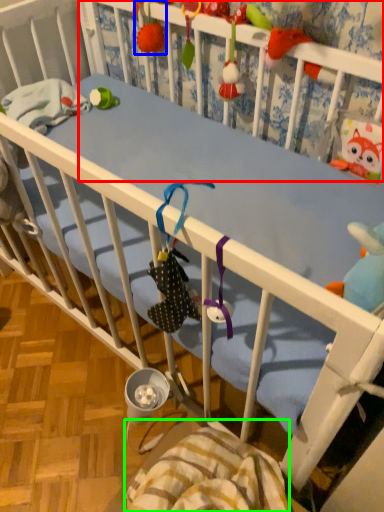
Question: Which object is the farthest from infant bed (highlighted by a red box)? Choose among these: toy (highlighted by a blue box) or blanket (highlighted by a green box).

Choices:
 (A) toy
 (B) blanket

Answer: (B)